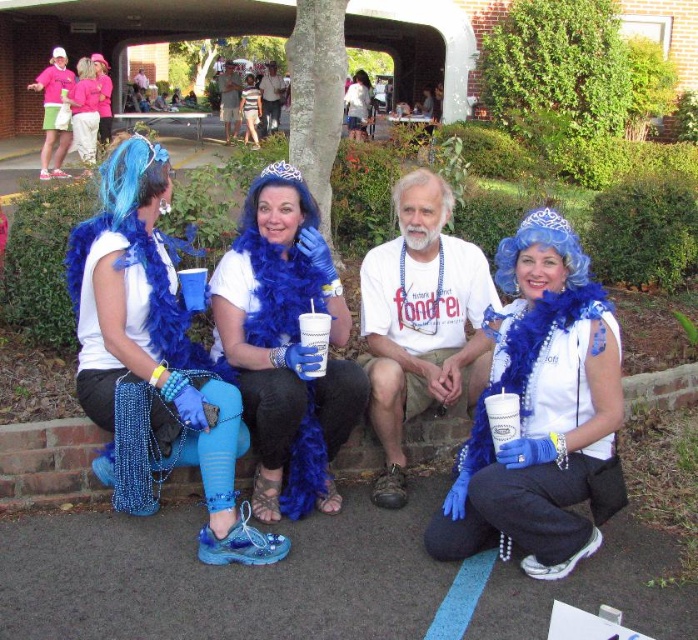
Question: Does matte blue feather boa at left lie in front of matte plastic cup at center?

Choices:
 (A) yes
 (B) no

Answer: (A)

Question: Which object appears farthest from the camera in this image?

Choices:
 (A) matte blue feather boa at lower right
 (B) white paper cup at lower center

Answer: (B)

Question: Can you confirm if matte blue feather boa at upper left is bigger than matte plastic cup at center?

Choices:
 (A) yes
 (B) no

Answer: (B)

Question: Which object is the farthest from the matte blue feather boa at upper left?

Choices:
 (A) matte blue feather boa at left
 (B) blue feather boa at center
 (C) matte blue feather boa at lower right
 (D) pink fabric dress at upper left

Answer: (C)

Question: Does matte blue feather boa at upper left come behind pink fabric dress at upper left?

Choices:
 (A) no
 (B) yes

Answer: (A)

Question: Which object appears farthest from the camera in this image?

Choices:
 (A) white paper cup at lower center
 (B) matte blue feather boa at left
 (C) pink fabric dress at upper left
 (D) matte blue feather boa at upper left

Answer: (C)